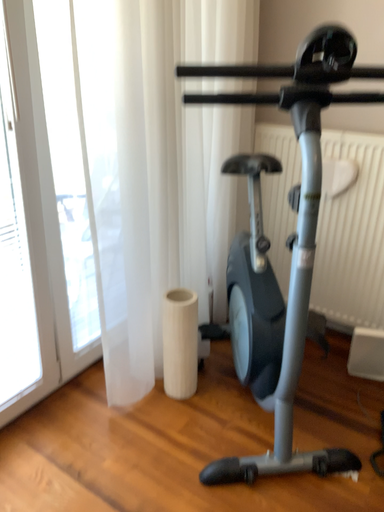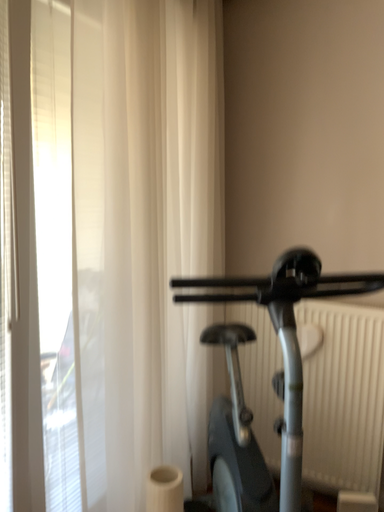
Question: How did the camera likely rotate when shooting the video?

Choices:
 (A) rotated downward
 (B) rotated upward

Answer: (B)